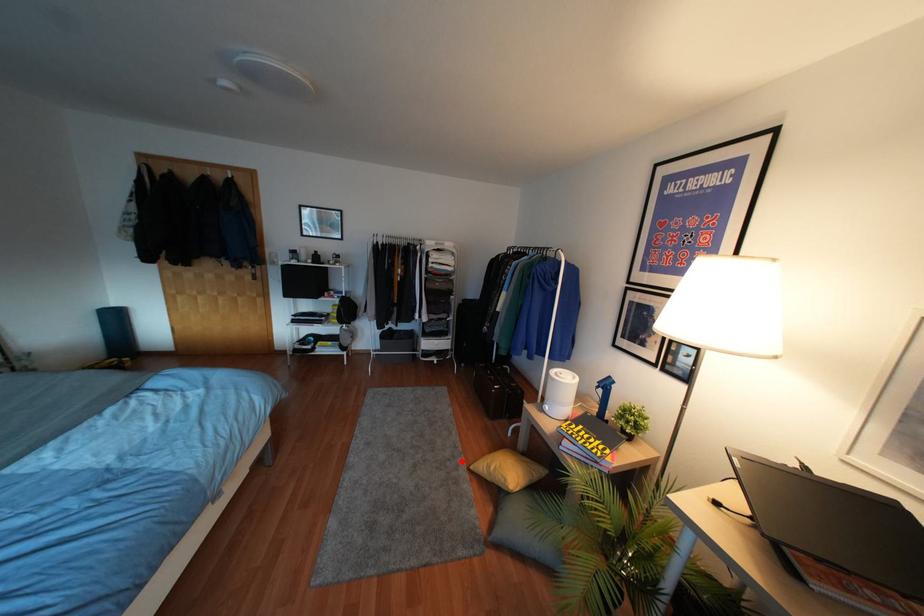
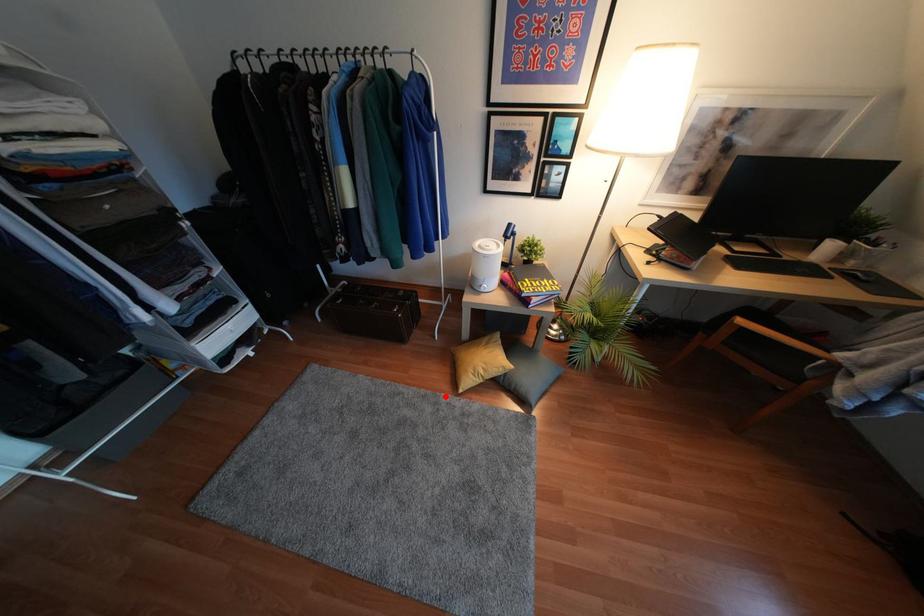
I am providing you with two images of the same scene from different viewpoints. A red point is marked on the first image and another point is marked on the second image. Is the red point in image1 aligned with the point shown in image2?

Yes